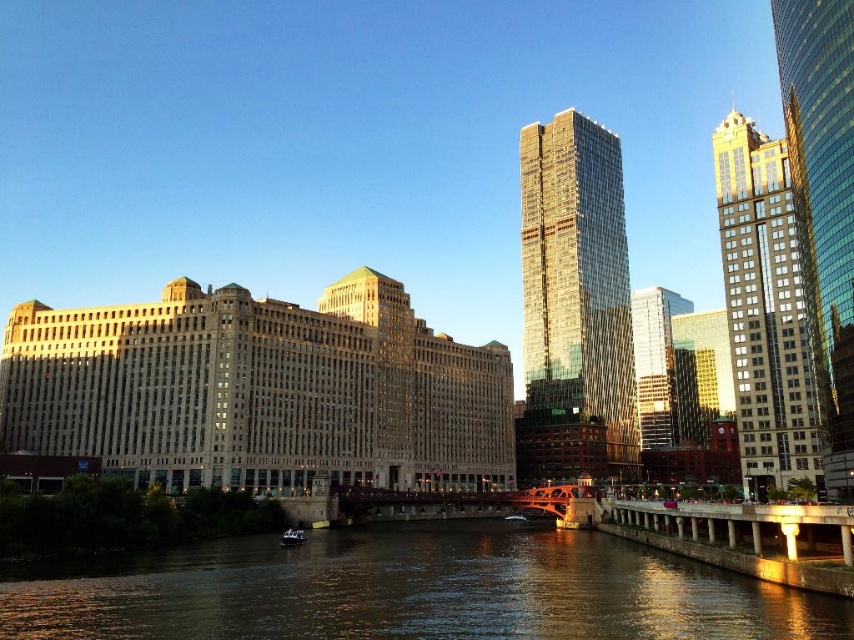
Between dark water at center and metallic silver boat at center, which one is positioned lower?

metallic silver boat at center is below.

Which is more to the right, dark water at center or metallic silver boat at center?

dark water at center

Is point (700, 579) closer to camera compared to point (282, 545)?

Yes, it is.

Find the location of a particular element. dark water at center is located at coordinates coord(410,592).

Between metallic silver boat at center and white plastic boat at center, which one appears on the left side from the viewer's perspective?

Positioned to the left is metallic silver boat at center.

Between point (295, 531) and point (519, 516), which one is positioned behind?

The point (519, 516) is more distant.

At what (x,y) coordinates should I click in order to perform the action: click on metallic silver boat at center. Please return your answer as a coordinate pair (x, y). Looking at the image, I should click on (291, 536).

Is point (330, 579) farther from camera compared to point (778, 384)?

That is False.

The image size is (854, 640). What do you see at coordinates (410, 592) in the screenshot?
I see `dark water at center` at bounding box center [410, 592].

Identify the location of dark water at center. (410, 592).

The image size is (854, 640). Identify the location of dark water at center. click(410, 592).